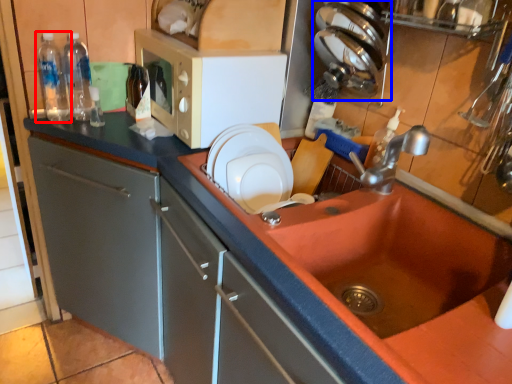
Question: Which object is further to the camera taking this photo, bottle (highlighted by a red box) or appliance (highlighted by a blue box)?

Choices:
 (A) bottle
 (B) appliance

Answer: (A)